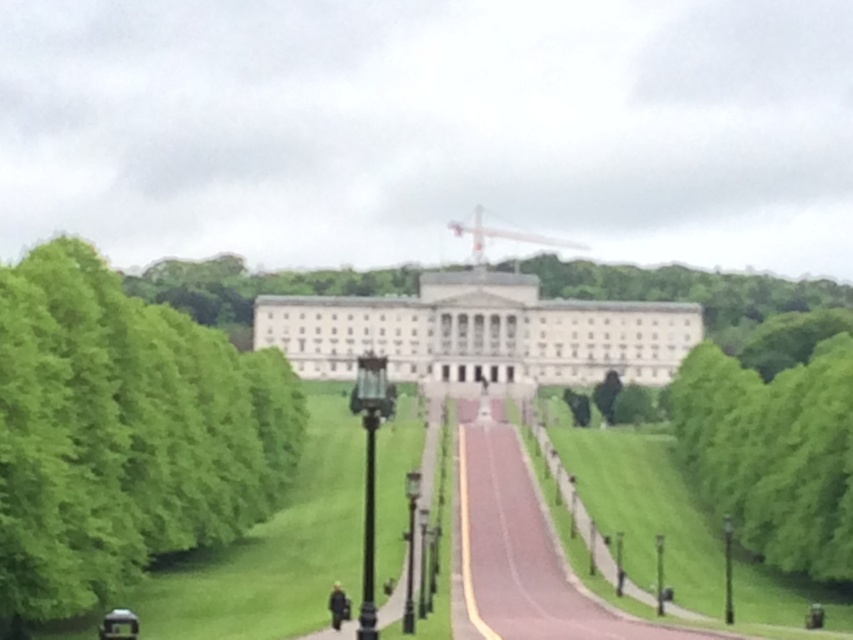
Between point (215, 452) and point (668, 307), which one is positioned behind?

The point (668, 307) is behind.

How far apart are green leafy tree at left and white stone building at center?

They are 342.85 feet apart.

Is point (45, 348) in front of point (363, 317)?

Yes, point (45, 348) is closer to viewer.

Locate an element on the screen. green leafy tree at left is located at coordinates (123, 433).

Between green leafy tree at left and black polished metal lamp post at center, which one appears on the right side from the viewer's perspective?

From the viewer's perspective, black polished metal lamp post at center appears more on the right side.

Is green leafy tree at left wider than black polished metal lamp post at center?

No.

Identify the location of green leafy tree at left. This screenshot has width=853, height=640. (123, 433).

Find the location of a particular element. green leafy tree at left is located at coordinates (123, 433).

Is white stone building at center taller than black polished metal lamp post at center?

Yes.

Does white stone building at center appear on the right side of black polished metal lamp post at center?

Indeed, white stone building at center is positioned on the right side of black polished metal lamp post at center.

Does point (279, 346) lie behind point (366, 636)?

Yes, it is behind point (366, 636).

I want to click on white stone building at center, so click(x=479, y=332).